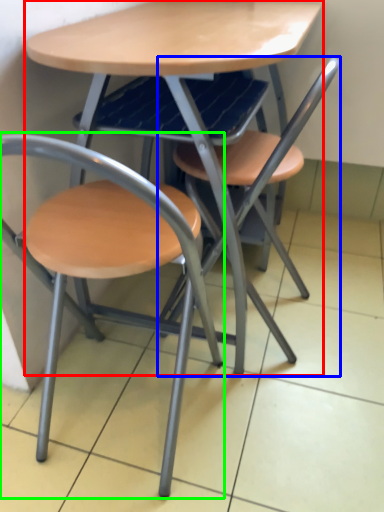
Question: Which object is positioned farthest from table (highlighted by a red box)? Select from chair (highlighted by a blue box) and chair (highlighted by a green box).

Choices:
 (A) chair
 (B) chair

Answer: (B)